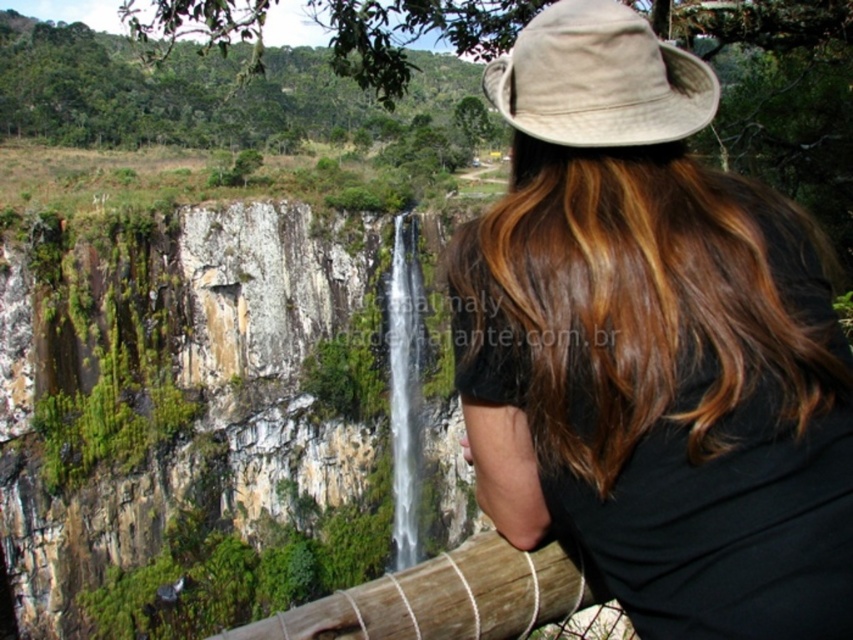
Question: Can you confirm if green mossy rock at center is positioned above brown wooden rail at lower center?

Choices:
 (A) yes
 (B) no

Answer: (B)

Question: Among these points, which one is farthest from the camera?

Choices:
 (A) (393, 444)
 (B) (146, 504)
 (C) (613, 116)

Answer: (A)

Question: Among these points, which one is farthest from the camera?

Choices:
 (A) (354, 632)
 (B) (160, 316)
 (C) (608, 524)

Answer: (B)

Question: From the image, what is the correct spatial relationship of green mossy rock at center in relation to beige fabric hat at upper center?

Choices:
 (A) left
 (B) right

Answer: (A)

Question: Where is brown hair at center located in relation to white smooth waterfall at center in the image?

Choices:
 (A) left
 (B) right

Answer: (B)

Question: Which point is closer to the camera?

Choices:
 (A) (395, 502)
 (B) (646, 96)

Answer: (B)